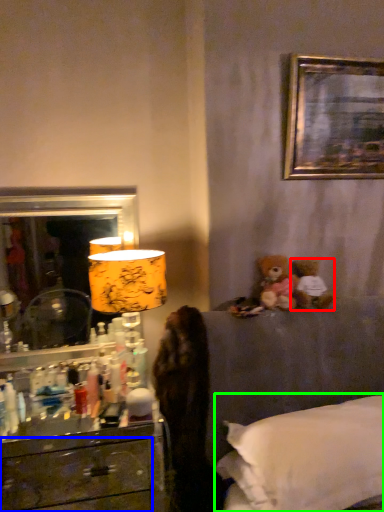
Question: Estimate the real-world distances between objects in this image. Which object is closer to teddy bear (highlighted by a red box), drawer (highlighted by a blue box) or bed (highlighted by a green box)?

Choices:
 (A) drawer
 (B) bed

Answer: (B)